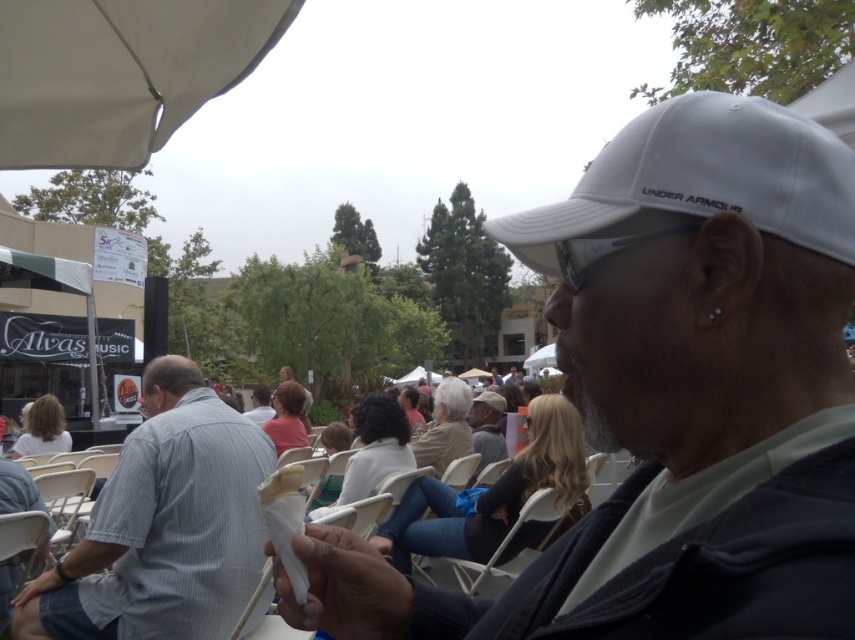
Consider the image. You are at an outdoor event and see two people in the image. One is wearing a striped cotton shirt at center and the other has a white matte baseball cap at upper right. Based on their positions, which person is closer to the left side of the image?

The striped cotton shirt at center is to the left of white matte baseball cap at upper right, so the person wearing the striped cotton shirt at center is closer to the left side of the image.

You are standing at the event and want to reach the point marked as point (342,573). The path is clear, but you have a 36 inch wide cart. Will the cart fit through the space between you and the point?

The distance between you and point (342,573) is 37.75 inches. Since your cart is 36 inches wide, it will fit as it is narrower than the available space.